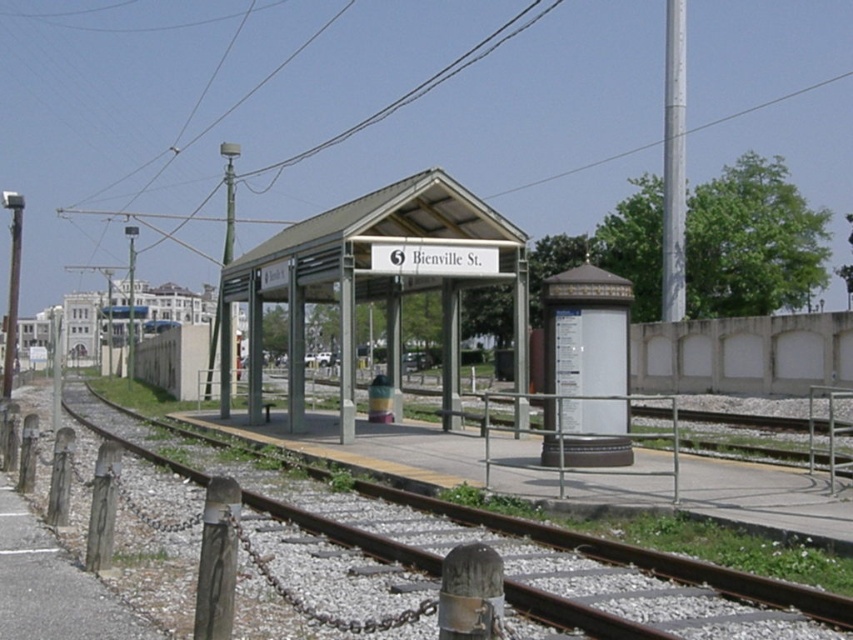
Between point (347, 401) and point (434, 515), which one is positioned in front?

Point (434, 515)

Who is lower down, metallic gray bus stop at center or rusty metal train track at lower left?

rusty metal train track at lower left is below.

Is point (512, 268) in front of point (641, 580)?

No, (512, 268) is behind (641, 580).

Where is `metallic gray bus stop at center`? metallic gray bus stop at center is located at coordinates (376, 278).

Does rusty metal train track at lower left appear on the right side of green matte pole at upper center?

Indeed, rusty metal train track at lower left is positioned on the right side of green matte pole at upper center.

Is point (672, 593) in front of point (231, 352)?

Yes, point (672, 593) is closer to viewer.

What are the coordinates of `rusty metal train track at lower left` in the screenshot? It's located at (573, 557).

Does white painted metal pole at upper right have a greater height compared to green matte pole at upper center?

Yes.

Is white painted metal pole at upper right below green matte pole at upper center?

Incorrect, white painted metal pole at upper right is not positioned below green matte pole at upper center.

Does point (668, 10) come farther from viewer compared to point (221, 342)?

That is True.

The height and width of the screenshot is (640, 853). I want to click on white painted metal pole at upper right, so click(x=672, y=163).